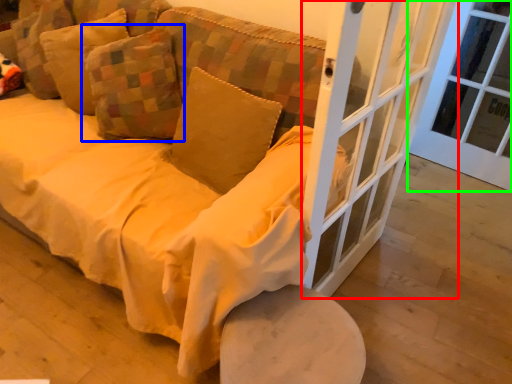
Question: Considering the real-world distances, which object is closest to screen door (highlighted by a red box)? pillow (highlighted by a blue box) or window frame (highlighted by a green box).

Choices:
 (A) pillow
 (B) window frame

Answer: (A)